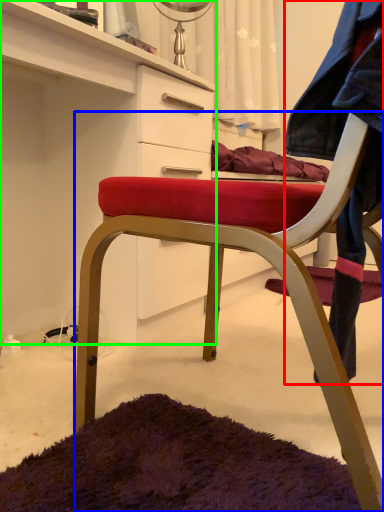
Question: Which object is positioned farthest from denim jacket (highlighted by a red box)? Select from chair (highlighted by a blue box) and cabinetry (highlighted by a green box).

Choices:
 (A) chair
 (B) cabinetry

Answer: (B)